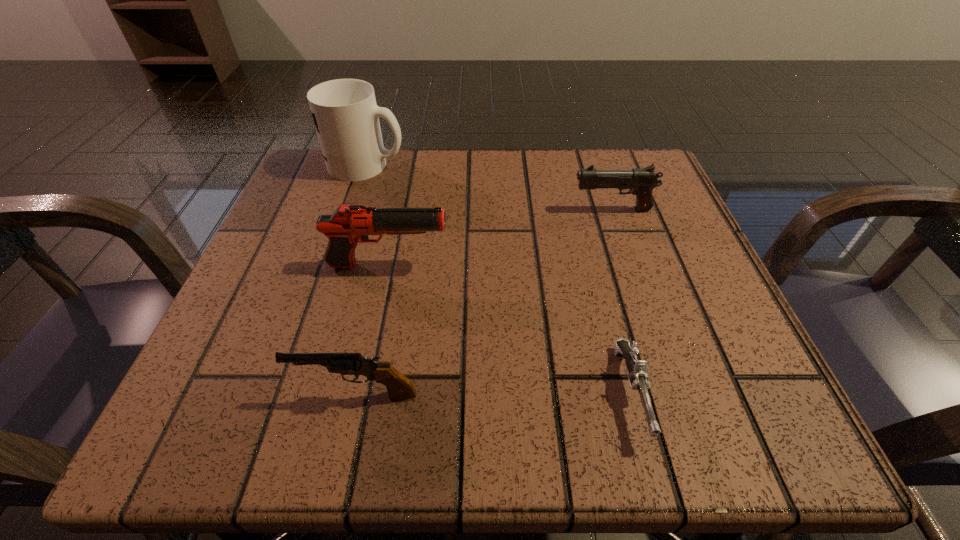
Where is `free location located 0.100m in the direction the fourth nearest object is aimed`? This screenshot has height=540, width=960. free location located 0.100m in the direction the fourth nearest object is aimed is located at coordinates (519, 210).

Where is `mug that is at the far edge`? mug that is at the far edge is located at coordinates (346, 117).

Image resolution: width=960 pixels, height=540 pixels. Find the location of `gun located in the far edge section of the desktop`. gun located in the far edge section of the desktop is located at coordinates (641, 182).

In order to click on mug that is positioned at the left edge in this screenshot , I will do `click(346, 117)`.

Where is `object that is at the right edge`? The image size is (960, 540). object that is at the right edge is located at coordinates (641, 182).

Identify the location of object that is positioned at the far left corner. (346, 117).

You are a GUI agent. You are given a task and a screenshot of the screen. Output one action in this format:
    pyautogui.click(x=<x>, y=<y>)
    Task: Click on the object present at the near left corner
    The width and height of the screenshot is (960, 540).
    Given the screenshot: What is the action you would take?
    pyautogui.click(x=399, y=387)

Find the location of a particular element. The height and width of the screenshot is (540, 960). object present at the far right corner is located at coordinates (641, 182).

Find the location of a particular element. This screenshot has height=540, width=960. vacant position at the far edge of the desktop is located at coordinates (539, 150).

Identify the location of vacant space at the near edge. This screenshot has width=960, height=540. (490, 428).